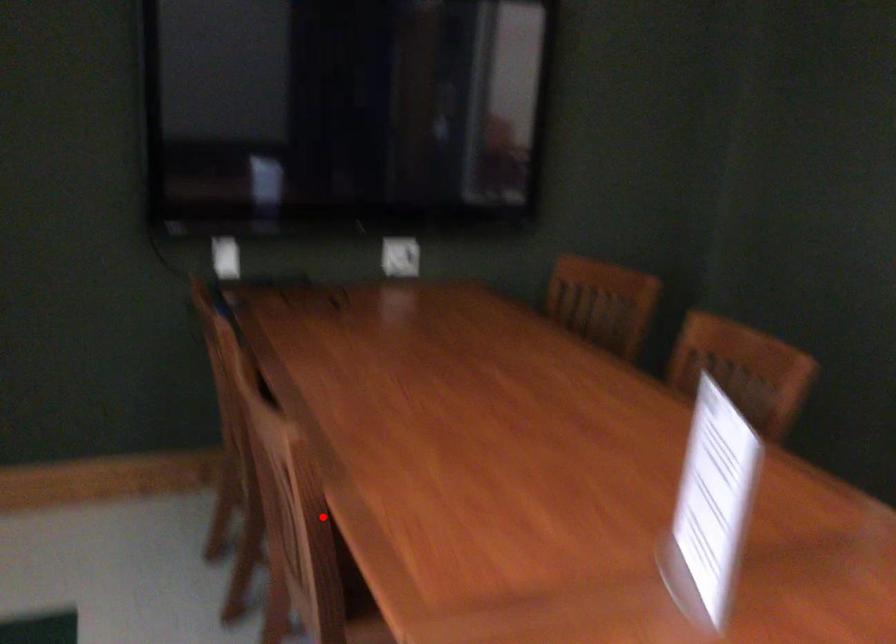
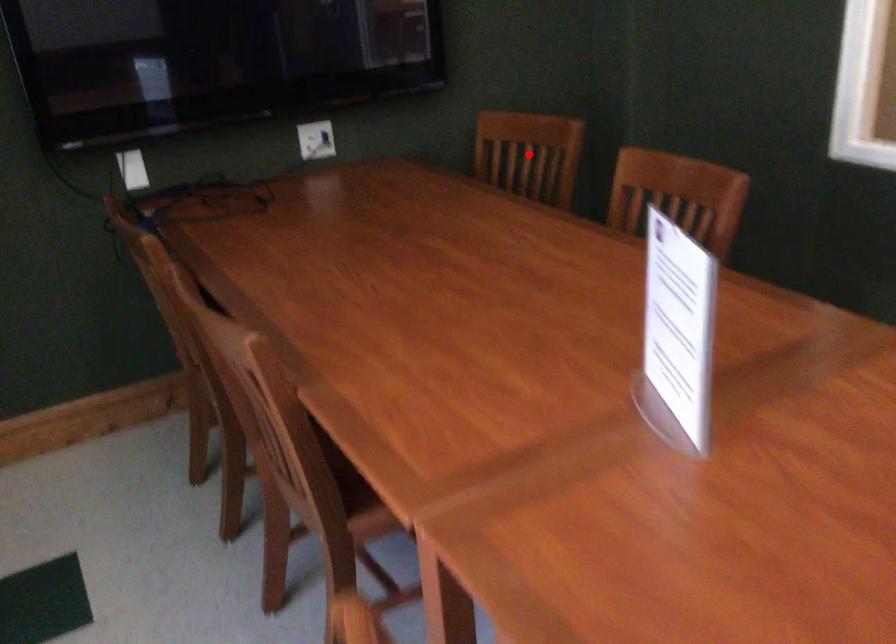
I am providing you with two images of the same scene from different viewpoints. A red point is marked on the first image and another point is marked on the second image. Are the points marked in image1 and image2 representing the same 3D position?

No